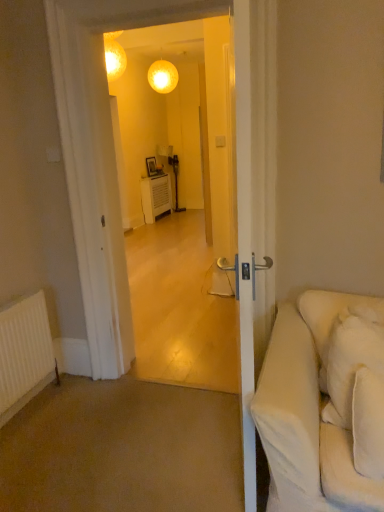
Describe the element at coordinates (351, 358) in the screenshot. I see `white soft pillow at right` at that location.

I want to click on matte glass sphere at upper center, so click(x=163, y=76).

Find the location of `transparent glass door at center`. transparent glass door at center is located at coordinates (179, 204).

Image resolution: width=384 pixels, height=512 pixels. I want to click on white soft pillow at right, so click(351, 358).

From the image's perspective, does matte glass sphere at upper center appear higher than white soft pillow at right?

Yes, from the image's perspective, matte glass sphere at upper center is on top of white soft pillow at right.

Considering the sizes of matte glass sphere at upper center and white soft pillow at right in the image, is matte glass sphere at upper center taller or shorter than white soft pillow at right?

Clearly, matte glass sphere at upper center is shorter compared to white soft pillow at right.

Considering the positions of point (344, 313) and point (127, 65), is point (344, 313) closer or farther from the camera than point (127, 65)?

Point (344, 313) is positioned closer to the camera compared to point (127, 65).

Is white soft pillow at right placed right next to transparent glass door at center?

There is a gap between white soft pillow at right and transparent glass door at center.

From the image's perspective, is white soft pillow at right on top of transparent glass door at center?

No, from the image's perspective, white soft pillow at right is not on top of transparent glass door at center.

In the scene shown: Is white soft pillow at right taller than transparent glass door at center?

No, white soft pillow at right is not taller than transparent glass door at center.

From the image's perspective, is transparent glass door at center beneath matte glass sphere at upper center?

Indeed, from the image's perspective, transparent glass door at center is shown beneath matte glass sphere at upper center.

From a real-world perspective, between transparent glass door at center and matte glass sphere at upper center, who is vertically higher?

matte glass sphere at upper center.

Can you tell me how much transparent glass door at center and matte glass sphere at upper center differ in facing direction?

178 degrees separate the facing orientations of transparent glass door at center and matte glass sphere at upper center.

Locate an element on the screen. lamp behind the white matte radiator at lower left is located at coordinates (163, 76).

Considering the positions of objects matte glass sphere at upper center and white matte radiator at lower left in the image provided, who is more to the right, matte glass sphere at upper center or white matte radiator at lower left?

From the viewer's perspective, matte glass sphere at upper center appears more on the right side.

From the image's perspective, between matte glass sphere at upper center and white matte radiator at lower left, which one is located above?

matte glass sphere at upper center is shown above in the image.

Is transparent glass door at center outside of white soft pillow at right?

Yes, transparent glass door at center is not within white soft pillow at right.

Is transparent glass door at center to the left of white soft pillow at right from the viewer's perspective?

Correct, you'll find transparent glass door at center to the left of white soft pillow at right.

Considering the positions of point (134, 137) and point (355, 312), is point (134, 137) closer or farther from the camera than point (355, 312)?

Clearly, point (134, 137) is more distant from the camera than point (355, 312).

Considering the relative positions of transparent glass door at center and white soft pillow at right in the image provided, is transparent glass door at center behind white soft pillow at right?

Yes, the depth of transparent glass door at center is greater than that of white soft pillow at right.

Consider the image. Which is in front, white matte radiator at lower left or white soft pillow at right?

white soft pillow at right is in front.

Considering the sizes of objects white matte radiator at lower left and white soft pillow at right in the image provided, who is bigger, white matte radiator at lower left or white soft pillow at right?

Bigger between the two is white soft pillow at right.

Is point (19, 333) positioned before point (350, 395)?

No, it is not.

In the scene shown: Considering the relative sizes of white matte radiator at lower left and white soft pillow at right in the image provided, is white matte radiator at lower left wider than white soft pillow at right?

Incorrect, the width of white matte radiator at lower left does not surpass that of white soft pillow at right.

Based on the photo, is white soft pillow at right behind matte glass sphere at upper center?

No, white soft pillow at right is closer to the camera.

From a real-world perspective, who is located higher, white soft pillow at right or matte glass sphere at upper center?

Answer: matte glass sphere at upper center.

Considering the sizes of objects white soft pillow at right and matte glass sphere at upper center in the image provided, who is bigger, white soft pillow at right or matte glass sphere at upper center?

white soft pillow at right is bigger.

Could you tell me if white soft pillow at right is turned towards matte glass sphere at upper center?

No, white soft pillow at right is not facing towards matte glass sphere at upper center.

Image resolution: width=384 pixels, height=512 pixels. Find the location of `pillow below the matte glass sphere at upper center (from a real-world perspective)`. pillow below the matte glass sphere at upper center (from a real-world perspective) is located at coordinates (351, 358).

Where is `screen door that is above the white soft pillow at right (from a real-world perspective)`? This screenshot has height=512, width=384. screen door that is above the white soft pillow at right (from a real-world perspective) is located at coordinates (179, 204).

Which object lies nearer to the anchor point white matte radiator at lower left, matte glass sphere at upper center or white soft pillow at right?

Among the two, white soft pillow at right is located nearer to white matte radiator at lower left.

In the scene shown: Based on their spatial positions, is white soft pillow at right or white matte radiator at lower left closer to transparent glass door at center?

Among the two, white matte radiator at lower left is located nearer to transparent glass door at center.

Considering their positions, is white matte radiator at lower left positioned further to matte glass sphere at upper center than white soft pillow at right?

white soft pillow at right is positioned further to the anchor matte glass sphere at upper center.

Which object lies nearer to the anchor point transparent glass door at center, white soft pillow at right or matte glass sphere at upper center?

matte glass sphere at upper center is positioned closer to the anchor transparent glass door at center.

Based on their spatial positions, is transparent glass door at center or white soft pillow at right closer to white matte radiator at lower left?

white soft pillow at right.

Which object lies further to the anchor point white matte radiator at lower left, white soft pillow at right or transparent glass door at center?

Based on the image, transparent glass door at center appears to be further to white matte radiator at lower left.

Which object lies further to the anchor point matte glass sphere at upper center, transparent glass door at center or white soft pillow at right?

white soft pillow at right is further to matte glass sphere at upper center.

When comparing their distances from white matte radiator at lower left, does transparent glass door at center or matte glass sphere at upper center seem further?

matte glass sphere at upper center.

I want to click on screen door located between white soft pillow at right and matte glass sphere at upper center in the depth direction, so click(179, 204).

Where is `screen door between white matte radiator at lower left and white soft pillow at right in the horizontal direction`? This screenshot has height=512, width=384. screen door between white matte radiator at lower left and white soft pillow at right in the horizontal direction is located at coordinates [x=179, y=204].

This screenshot has height=512, width=384. What are the coordinates of `radiator between white soft pillow at right and matte glass sphere at upper center along the z-axis` in the screenshot? It's located at (24, 353).

Locate an element on the screen. This screenshot has width=384, height=512. radiator between transparent glass door at center and matte glass sphere at upper center from front to back is located at coordinates (24, 353).